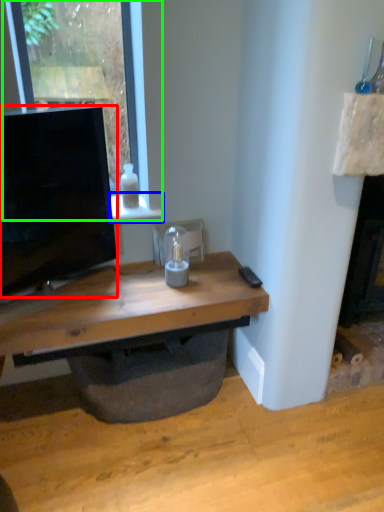
Question: Considering the real-world distances, which object is closest to television (highlighted by a red box)? window sill (highlighted by a blue box) or window (highlighted by a green box).

Choices:
 (A) window sill
 (B) window

Answer: (A)